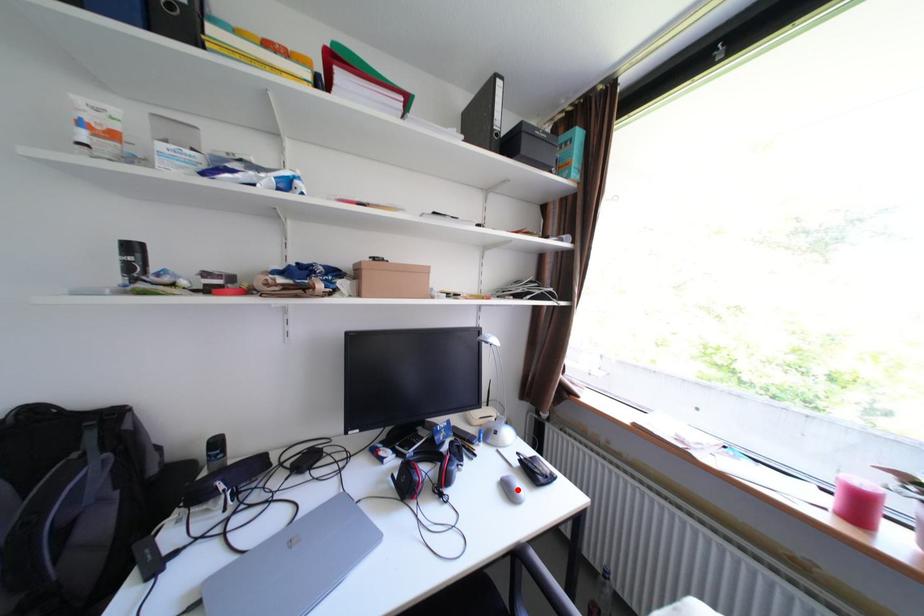
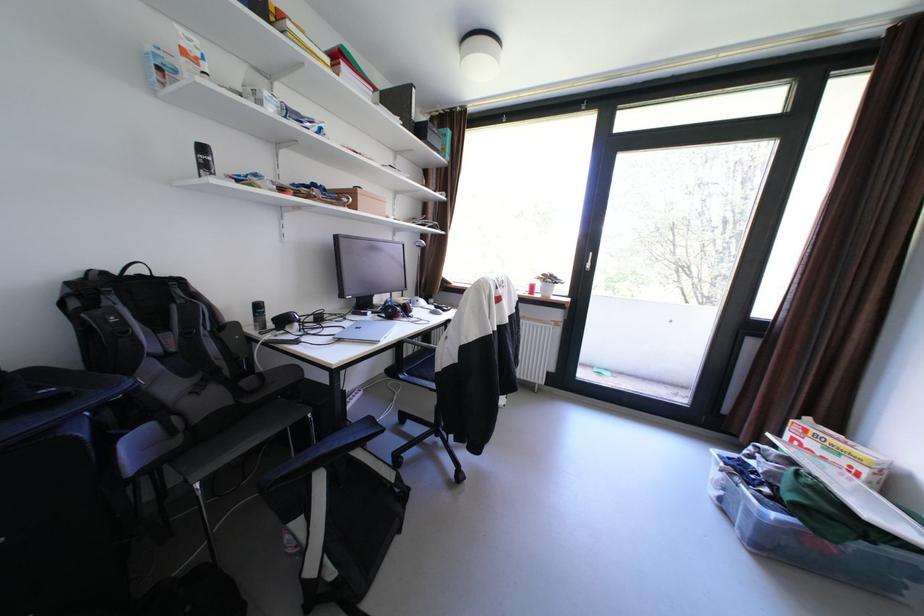
Question: I am providing you with two images of the same scene from different viewpoints. A red point is marked on the first image. Is the red point's position out of view in image 2?

Choices:
 (A) Yes
 (B) No

Answer: (A)